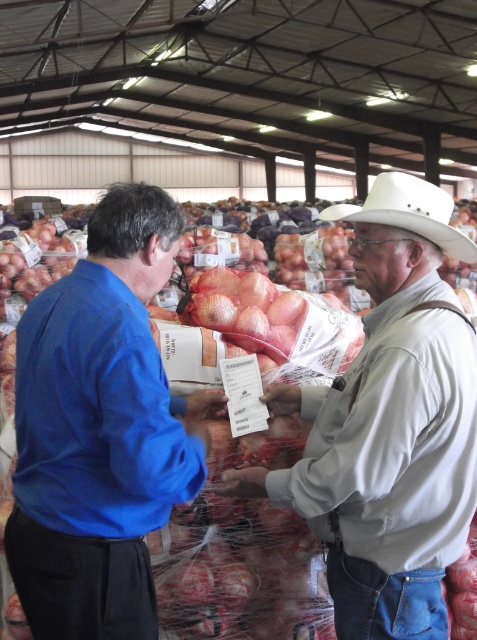
You are standing in the warehouse and need to locate the blue fabric shirt at left. According to the coordinates provided, where should you look to find it?

The blue fabric shirt at left is located at coordinates point 0.673 on the x axis and 0.212 on the y axis.

You are a security camera monitoring the warehouse. You need to determine who is closer to the entrance located at the back of the image. Based on the positions of the blue fabric shirt at left and the light gray cotton shirt at center, which individual is closer to the entrance?

The blue fabric shirt at left is in front of the light gray cotton shirt at center, meaning the light gray cotton shirt at center is closer to the entrance located at the back of the image.

You are a security camera in the warehouse. You need to determine which object is larger between the blue fabric shirt at left and the white matte cowboy hat at center. Based on the scene, which one is bigger?

The blue fabric shirt at left is bigger than the white matte cowboy hat at center according to the description.